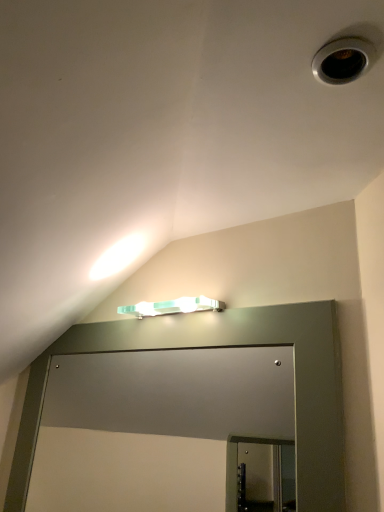
Question: From the image's perspective, relative to mint green plastic light fixture at upper center, is matte gray glass door at center above or below?

Choices:
 (A) above
 (B) below

Answer: (B)

Question: In terms of height, does matte gray glass door at center look taller or shorter compared to mint green plastic light fixture at upper center?

Choices:
 (A) tall
 (B) short

Answer: (A)

Question: Does point (119, 381) appear closer or farther from the camera than point (162, 308)?

Choices:
 (A) farther
 (B) closer

Answer: (A)

Question: From the image's perspective, is mint green plastic light fixture at upper center positioned above or below matte gray glass door at center?

Choices:
 (A) above
 (B) below

Answer: (A)

Question: Is point (223, 307) closer or farther from the camera than point (178, 416)?

Choices:
 (A) closer
 (B) farther

Answer: (A)

Question: Considering the positions of mint green plastic light fixture at upper center and matte gray glass door at center in the image, is mint green plastic light fixture at upper center taller or shorter than matte gray glass door at center?

Choices:
 (A) short
 (B) tall

Answer: (A)

Question: Is mint green plastic light fixture at upper center inside or outside of matte gray glass door at center?

Choices:
 (A) outside
 (B) inside

Answer: (A)